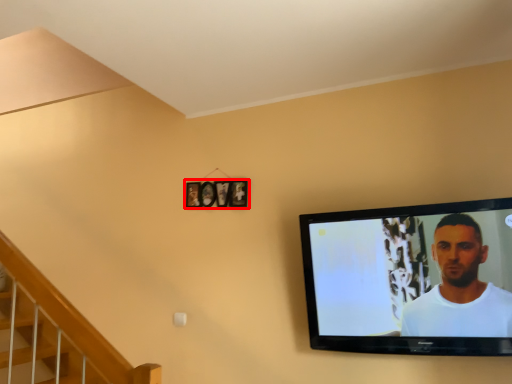
Question: From the image's perspective, where is picture frame (annotated by the red box) located in relation to television in the image?

Choices:
 (A) below
 (B) above

Answer: (B)